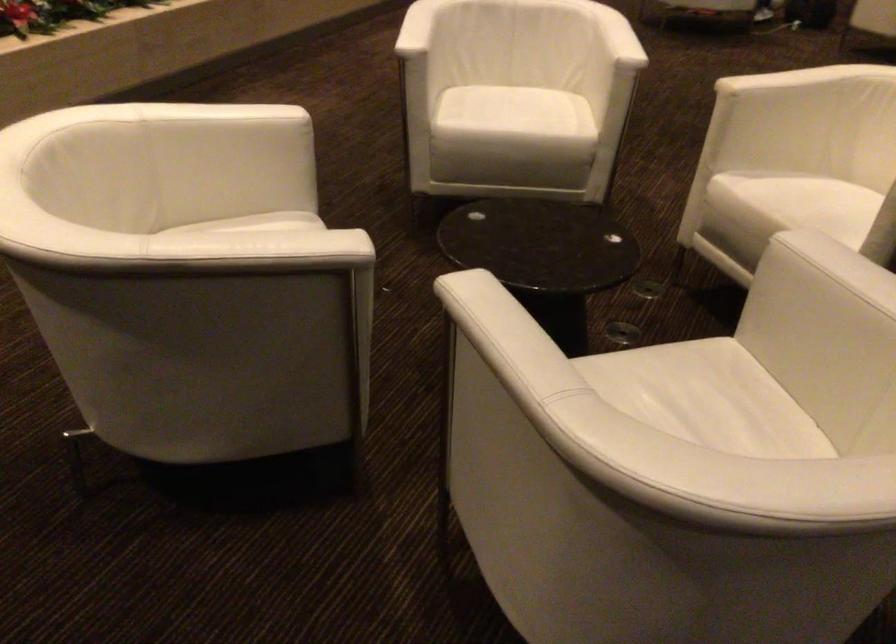
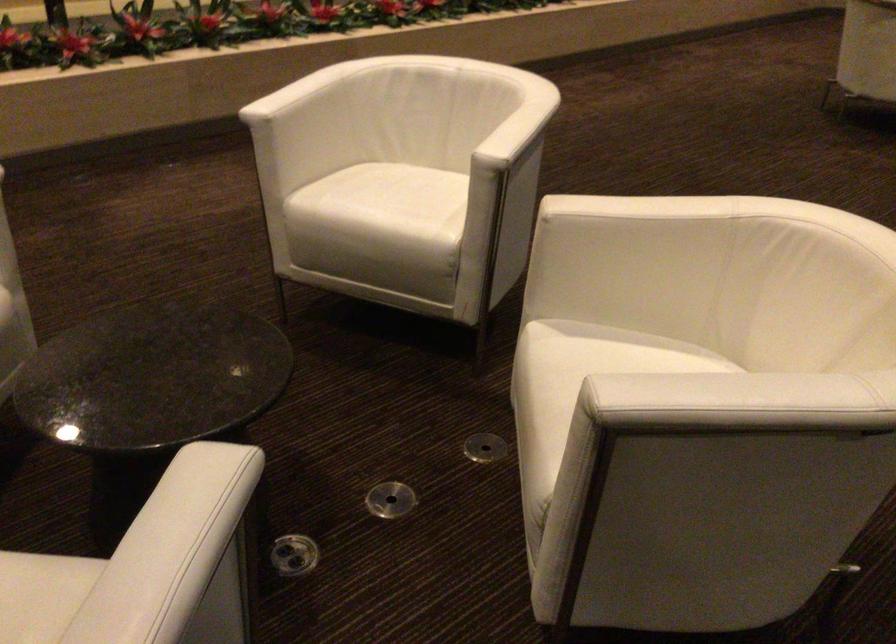
Where in the second image is the point corresponding to pixel 517 114 from the first image?

(383, 205)